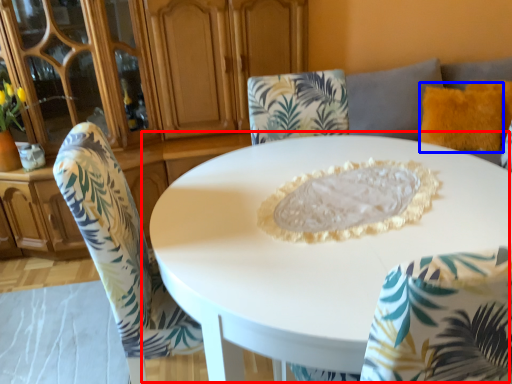
Question: Which point is further to the camera, table (highlighted by a red box) or pillow (highlighted by a blue box)?

Choices:
 (A) table
 (B) pillow

Answer: (B)